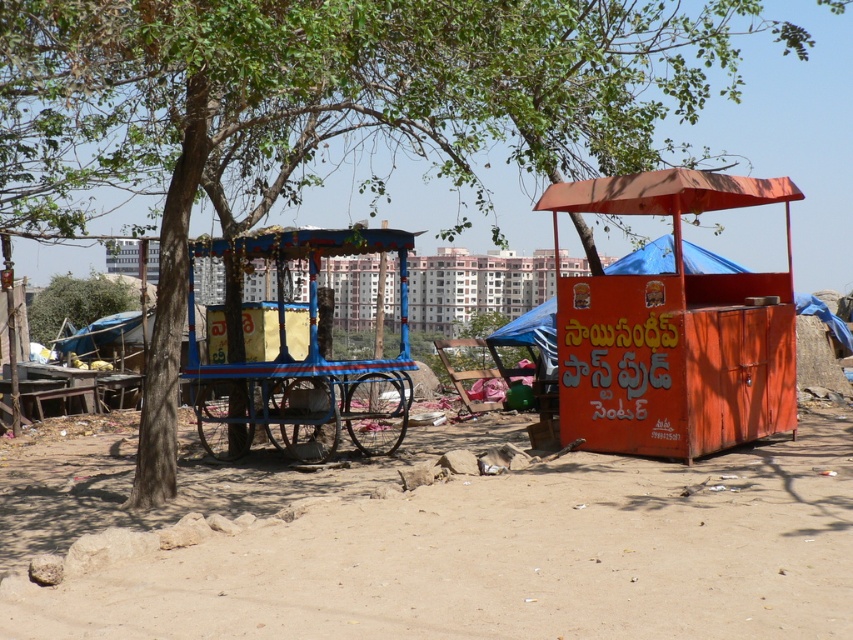
Question: Does blue painted wood cart at center have a smaller size compared to green leafy tree at center?

Choices:
 (A) yes
 (B) no

Answer: (A)

Question: Which is nearer to the blue painted wood cart at center?

Choices:
 (A) orange painted cart at right
 (B) green leafy tree at center

Answer: (A)

Question: Can you confirm if dusty sand at lower center is positioned above orange painted cart at right?

Choices:
 (A) no
 (B) yes

Answer: (A)

Question: Which of the following is the closest to the observer?

Choices:
 (A) dusty sand at lower center
 (B) orange painted cart at right
 (C) blue painted wood cart at center
 (D) blue fabric canopy at center

Answer: (A)

Question: Which of these objects is positioned farthest from the dusty sand at lower center?

Choices:
 (A) orange painted cart at right
 (B) green leafy tree at center
 (C) blue painted wood cart at center

Answer: (B)

Question: Considering the relative positions of blue painted wood cart at center and blue fabric canopy at center in the image provided, where is blue painted wood cart at center located with respect to blue fabric canopy at center?

Choices:
 (A) right
 (B) left

Answer: (B)